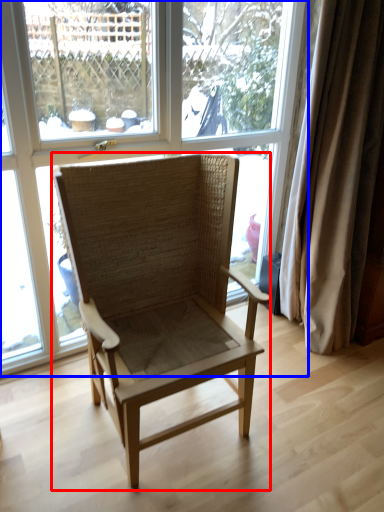
Question: Which object appears closest to the camera in this image, chair (highlighted by a red box) or window (highlighted by a blue box)?

Choices:
 (A) chair
 (B) window

Answer: (A)